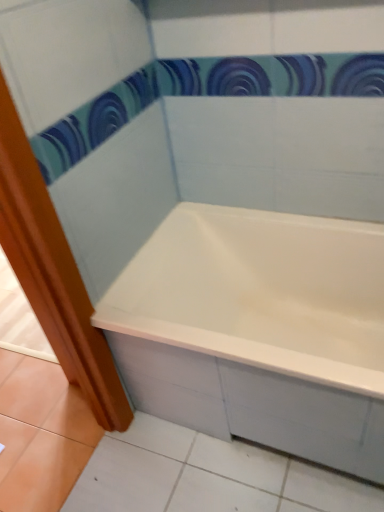
I want to click on white glossy bathtub at center, so click(259, 330).

Image resolution: width=384 pixels, height=512 pixels. What do you see at coordinates (259, 330) in the screenshot?
I see `white glossy bathtub at center` at bounding box center [259, 330].

Where is `white glossy bathtub at center`? white glossy bathtub at center is located at coordinates (259, 330).